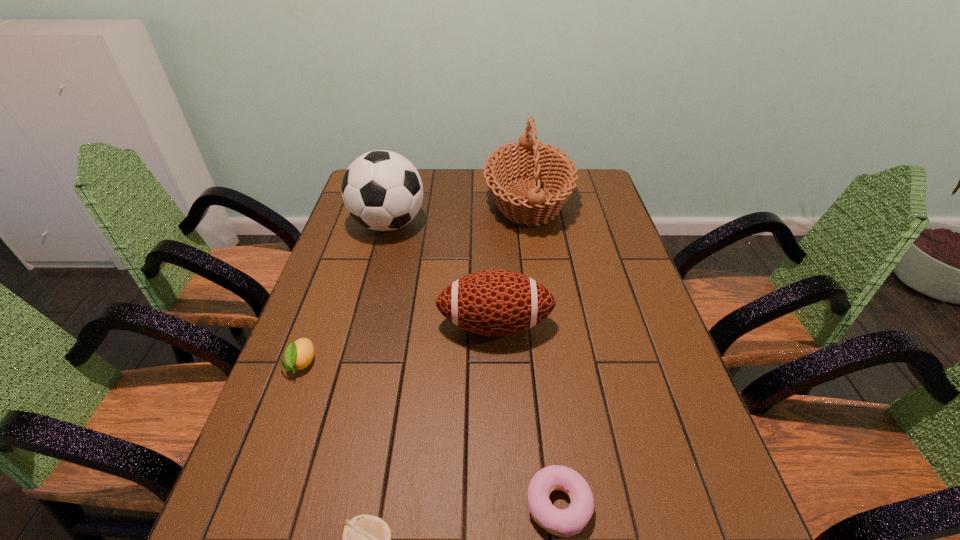
Where is `soccer ball located in the left edge section of the desktop`? Image resolution: width=960 pixels, height=540 pixels. soccer ball located in the left edge section of the desktop is located at coordinates (382, 190).

This screenshot has width=960, height=540. I want to click on lemon located in the left edge section of the desktop, so click(299, 354).

You are a GUI agent. You are given a task and a screenshot of the screen. Output one action in this format:
    pyautogui.click(x=<x>, y=<y>)
    Task: Click on the object that is at the right edge
    The width and height of the screenshot is (960, 540).
    Given the screenshot: What is the action you would take?
    pyautogui.click(x=528, y=158)

Find the location of a particular element. object located at the far right corner is located at coordinates (528, 158).

The height and width of the screenshot is (540, 960). In the image, there is a desktop. What are the coordinates of `vacant space at the far edge` in the screenshot? It's located at (489, 193).

This screenshot has width=960, height=540. I want to click on vacant position at the left edge of the desktop, so click(x=333, y=347).

Identify the location of free space at the right edge of the desktop. The height and width of the screenshot is (540, 960). (621, 349).

Image resolution: width=960 pixels, height=540 pixels. I want to click on vacant region at the far right corner of the desktop, so coord(600,179).

This screenshot has width=960, height=540. I want to click on free point between the football and the soccer ball, so click(x=442, y=275).

The width and height of the screenshot is (960, 540). I want to click on vacant space that is in between the fourth shortest object and the basket, so click(512, 263).